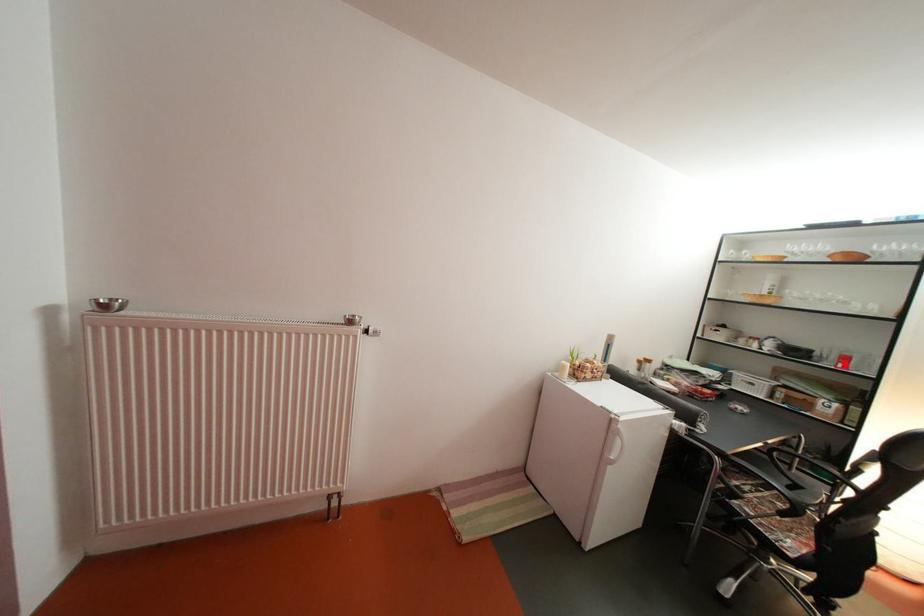
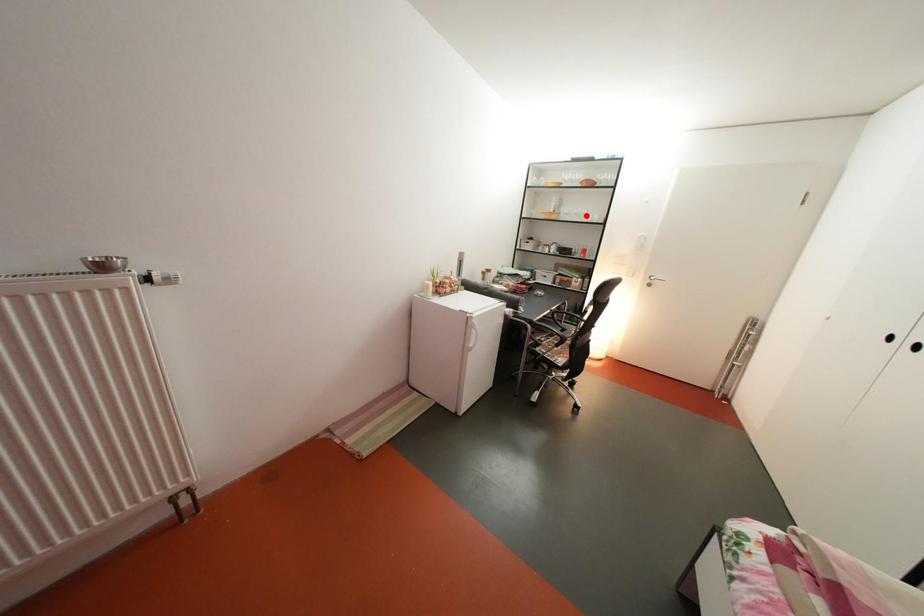
I am providing you with two images of the same scene from different viewpoints. A red point is marked on the first image and another point is marked on the second image. Are the points marked in image1 and image2 representing the same 3D position?

No